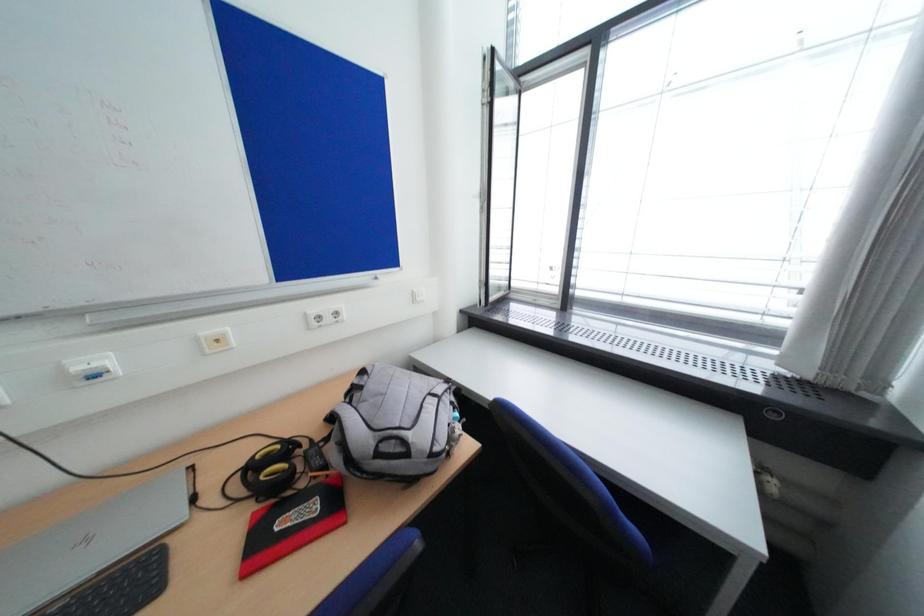
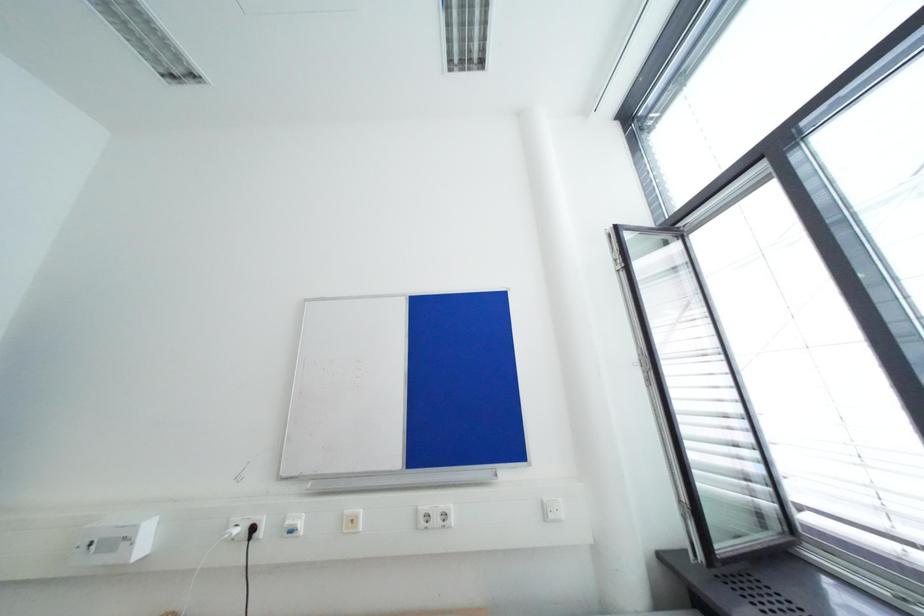
Based on the continuous images, in which direction is the camera rotating?

The camera rotated toward left-up.